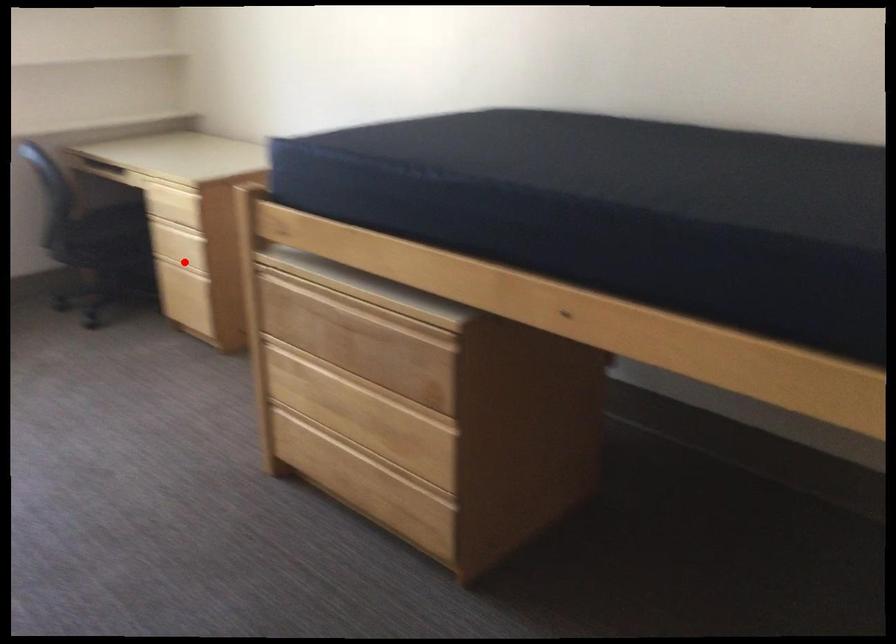
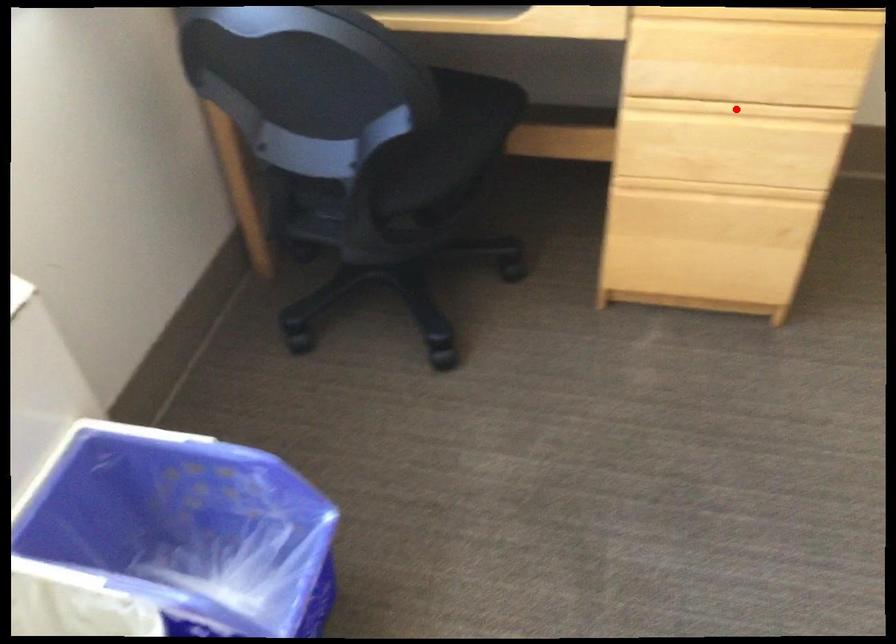
I am providing you with two images of the same scene from different viewpoints. A red point is marked on the first image and another point is marked on the second image. Does the point marked in image1 correspond to the same location as the one in image2?

No